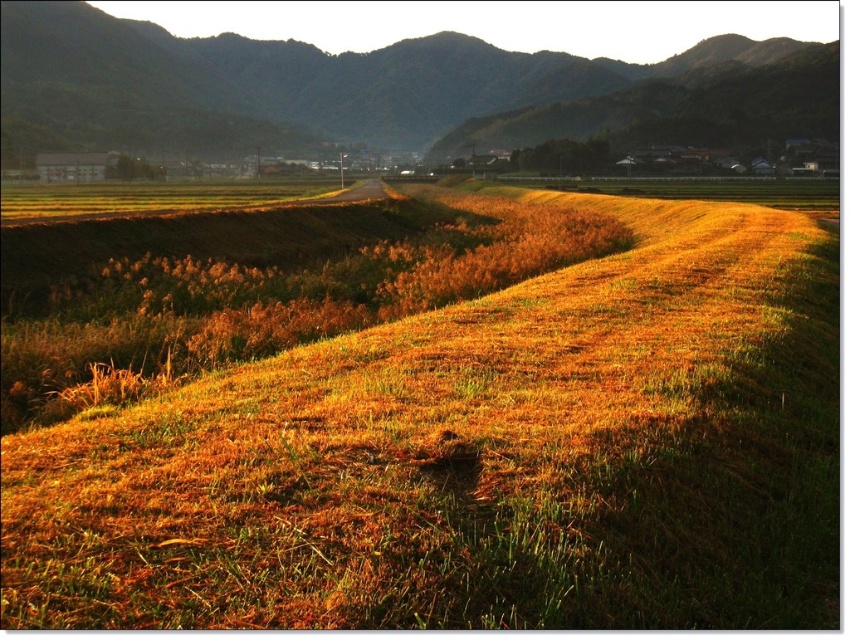
Question: Is the position of golden grassy field at center more distant than that of brown textured hillside at center?

Choices:
 (A) yes
 (B) no

Answer: (B)

Question: Considering the relative positions of golden grassy field at center and brown textured hillside at center in the image provided, where is golden grassy field at center located with respect to brown textured hillside at center?

Choices:
 (A) right
 (B) left

Answer: (A)

Question: Is golden grassy field at center in front of brown textured hillside at center?

Choices:
 (A) yes
 (B) no

Answer: (A)

Question: Among these objects, which one is farthest from the camera?

Choices:
 (A) brown textured hillside at center
 (B) golden grassy field at center

Answer: (A)